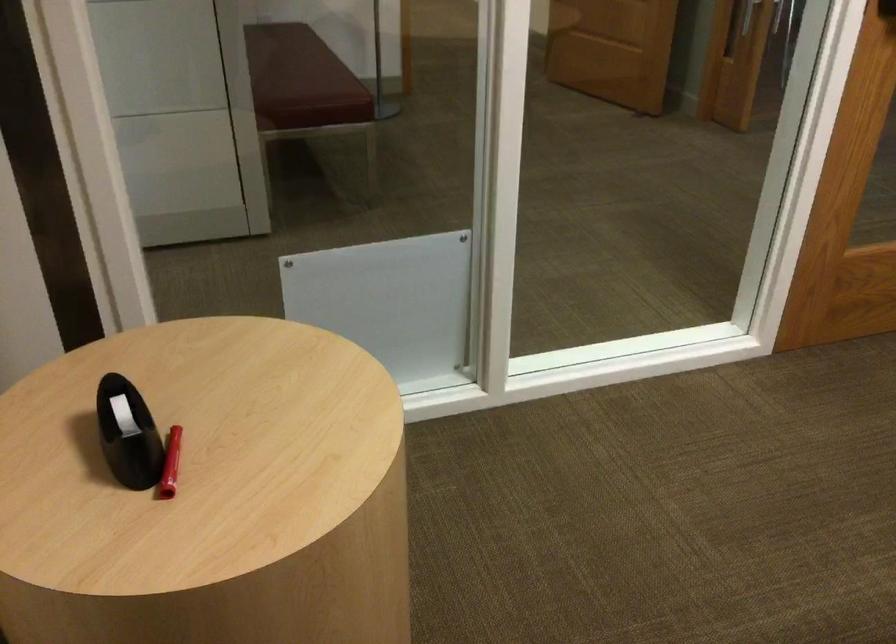
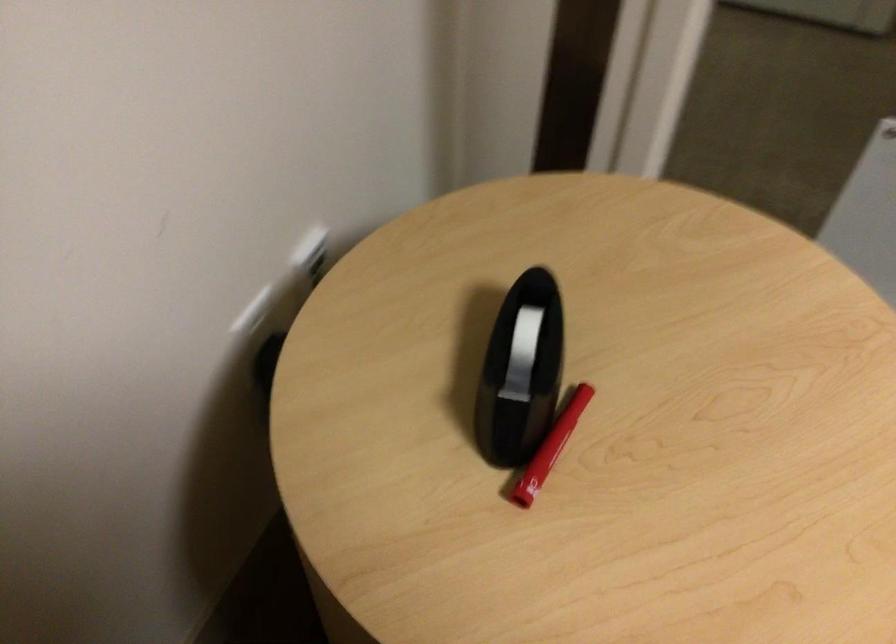
In the second image, find the point that corresponds to [127,431] in the first image.

(521, 371)